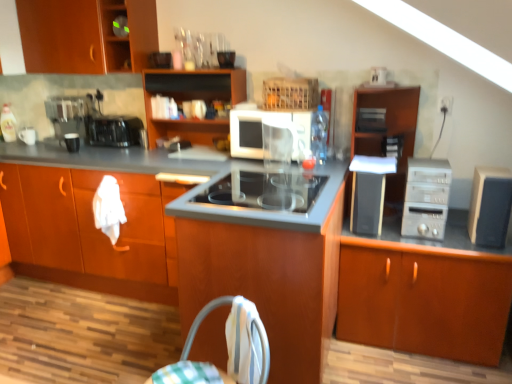
Where is `empty space that is ontop of satin silver computer tower at right`? This screenshot has height=384, width=512. empty space that is ontop of satin silver computer tower at right is located at coordinates (426, 166).